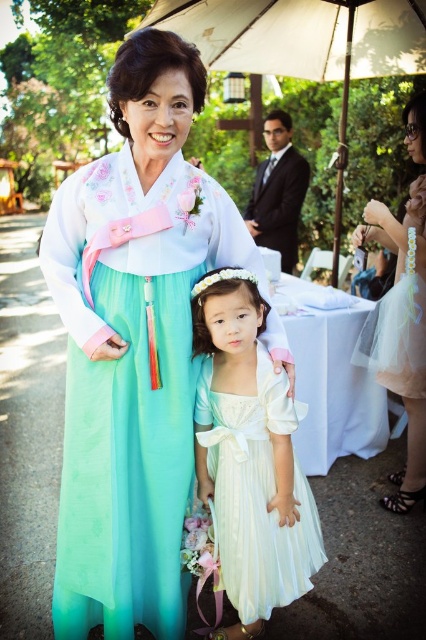
Question: Which object is the closest to the white fabric umbrella at upper center?

Choices:
 (A) pastel green silk hanbok at center
 (B) dark blue satin suit at center
 (C) white satin dress at center

Answer: (B)

Question: Estimate the real-world distances between objects in this image. Which object is farther from the light pink tulle dress at right?

Choices:
 (A) white fabric umbrella at upper center
 (B) white satin dress at center
 (C) pastel green silk hanbok at center

Answer: (C)

Question: Is tulle dress at lower right closer to the viewer compared to dark blue satin suit at center?

Choices:
 (A) yes
 (B) no

Answer: (A)

Question: Observing the image, what is the correct spatial positioning of white satin dress at center in reference to dark blue satin suit at center?

Choices:
 (A) above
 (B) below

Answer: (B)

Question: Which point is farther to the camera?

Choices:
 (A) white satin dress at center
 (B) tulle dress at lower right
 (C) pastel green silk hanbok at center
 (D) dark blue satin suit at center

Answer: (D)

Question: Can you confirm if white satin dress at center is positioned below tulle dress at lower right?

Choices:
 (A) no
 (B) yes

Answer: (B)